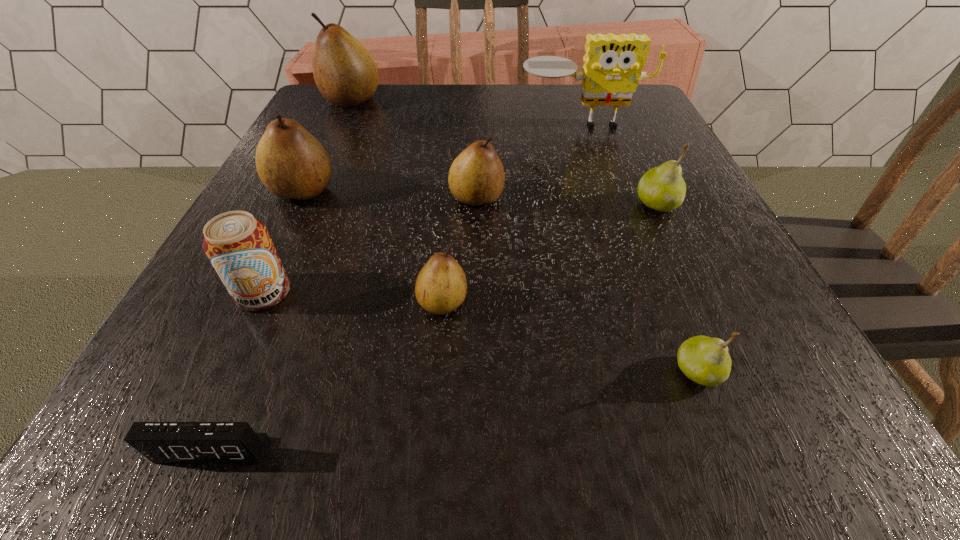
The width and height of the screenshot is (960, 540). I want to click on the tallest pear, so click(x=345, y=73).

Find the location of a particular element. The image size is (960, 540). the biggest brown pear is located at coordinates (345, 73).

The image size is (960, 540). In order to click on sponge in this screenshot , I will do (x=612, y=68).

Where is `the fifth shortest pear`? the fifth shortest pear is located at coordinates click(x=291, y=163).

Identify the location of the bigger green pear. The image size is (960, 540). (662, 188).

Locate an element on the screen. the second smallest brown pear is located at coordinates (476, 177).

The image size is (960, 540). Identify the location of beer can. (239, 247).

Identify the location of the nearest brown pear. (441, 286).

Find the location of a particular element. This screenshot has width=960, height=540. the fifth farthest pear is located at coordinates point(441,286).

At what (x,y) coordinates should I click in order to perform the action: click on the eighth farthest object. Please return your answer as a coordinate pair (x, y). The width and height of the screenshot is (960, 540). Looking at the image, I should click on (706, 361).